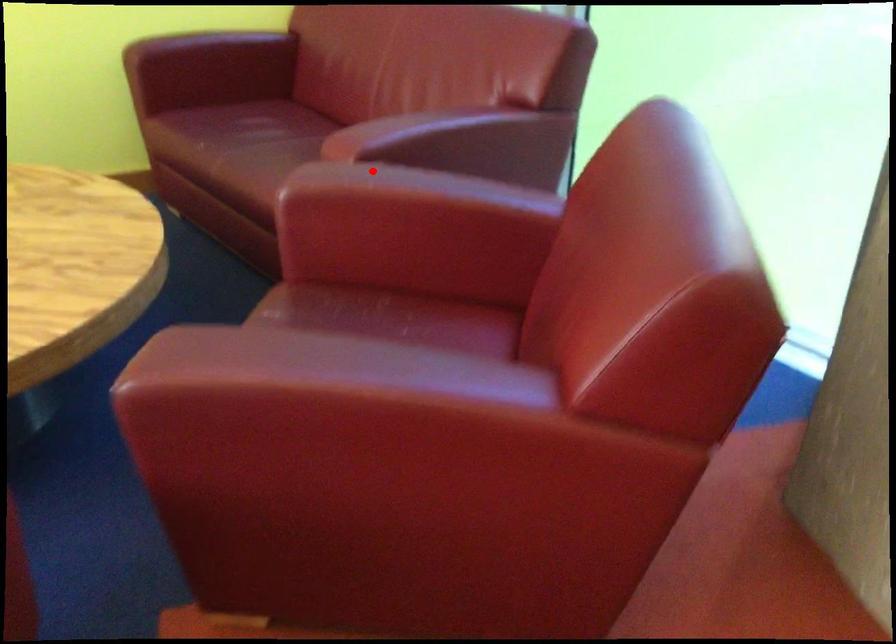
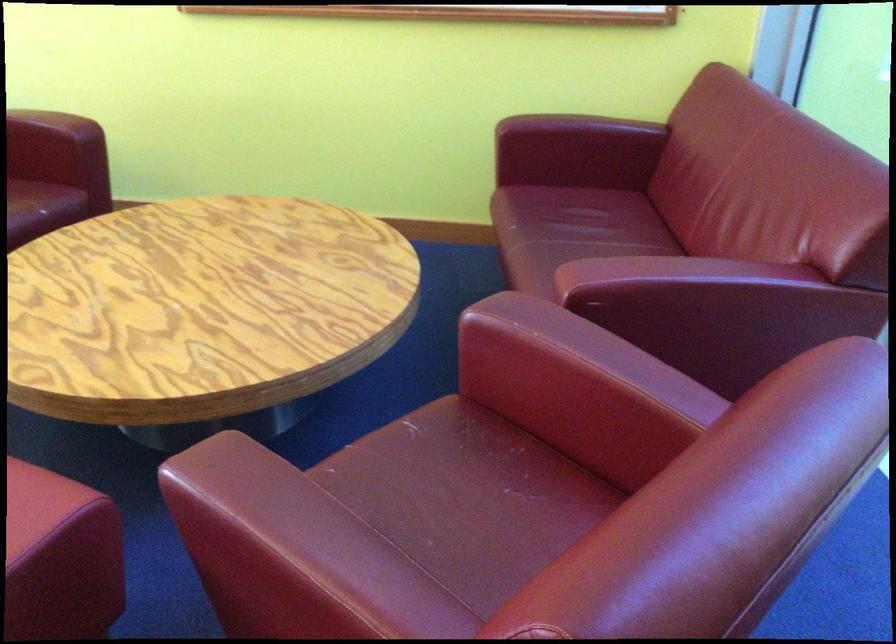
Find the pixel in the second image that matches the highlighted location in the first image.

(540, 319)